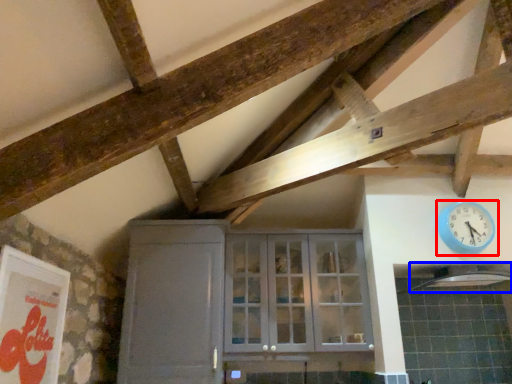
Question: Which object is closer to the camera taking this photo, wall clock (highlighted by a red box) or exhaust hood (highlighted by a blue box)?

Choices:
 (A) wall clock
 (B) exhaust hood

Answer: (B)